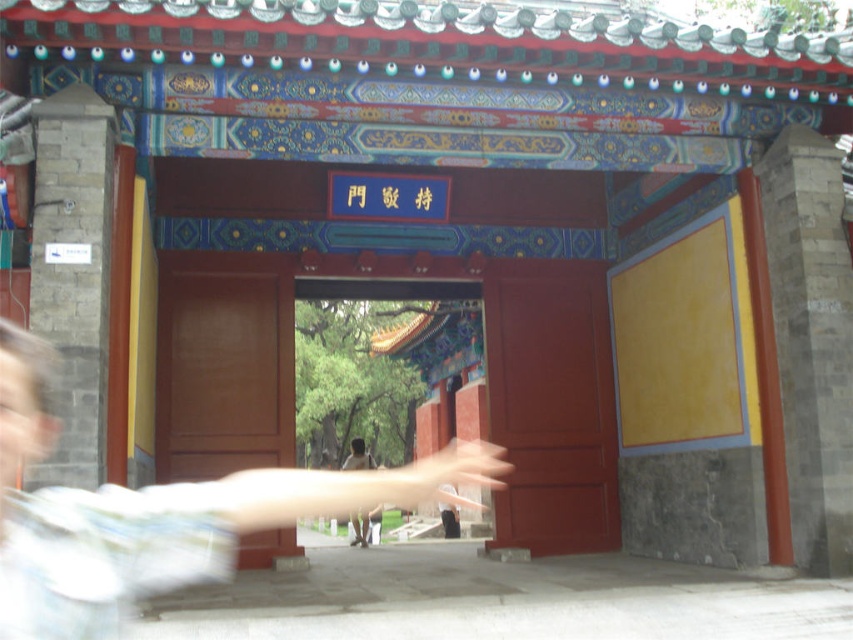
The width and height of the screenshot is (853, 640). What do you see at coordinates (155, 513) in the screenshot?
I see `blurred motion arm at center` at bounding box center [155, 513].

Does point (198, 506) come farther from viewer compared to point (351, 465)?

No, it is not.

Who is more forward, (245, 531) or (364, 454)?

Point (245, 531) is more forward.

Where is `blurred motion arm at center`? blurred motion arm at center is located at coordinates (155, 513).

Which is in front, point (102, 547) or point (286, 529)?

Point (102, 547)

Which is more to the right, blurred motion arm at center or matte wood door at left?

From the viewer's perspective, blurred motion arm at center appears more on the right side.

Locate an element on the screen. blurred motion arm at center is located at coordinates (155, 513).

This screenshot has height=640, width=853. In order to click on blurred motion arm at center in this screenshot , I will do `click(155, 513)`.

In the scene shown: Does matte wood door at left appear over light brown wooden hand at center?

Yes, matte wood door at left is above light brown wooden hand at center.

Consider the image. Is matte wood door at left bigger than light brown wooden hand at center?

No, matte wood door at left is not bigger than light brown wooden hand at center.

Between point (199, 432) and point (360, 445), which one is positioned in front?

Point (199, 432) is more forward.

Locate an element on the screen. matte wood door at left is located at coordinates (222, 365).